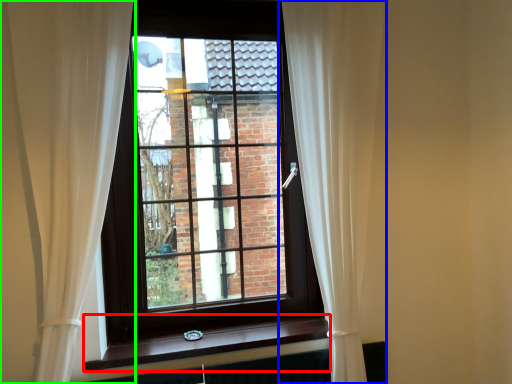
Question: Which object is positioned farthest from window sill (highlighted by a red box)? Select from curtain (highlighted by a blue box) and curtain (highlighted by a green box).

Choices:
 (A) curtain
 (B) curtain

Answer: (A)